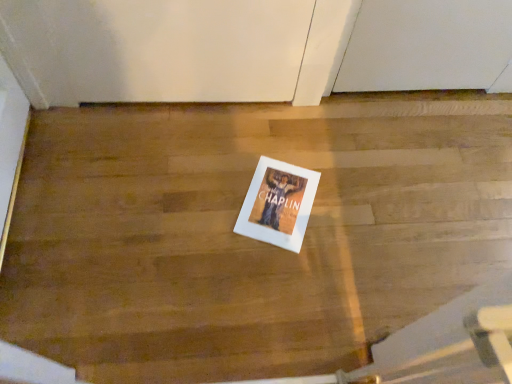
This screenshot has height=384, width=512. In order to click on vacant area situated to the left side of white paper at center in this screenshot , I will do `click(204, 186)`.